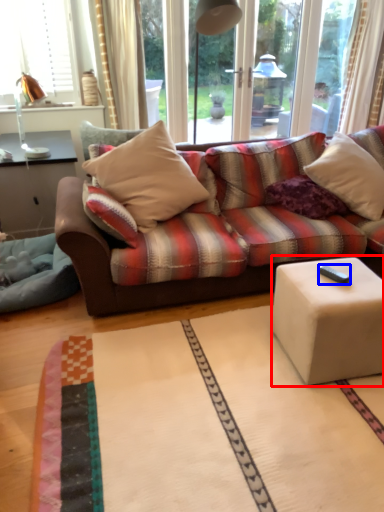
Question: Which object appears closest to the camera in this image, table (highlighted by a red box) or remote control (highlighted by a blue box)?

Choices:
 (A) table
 (B) remote control

Answer: (A)